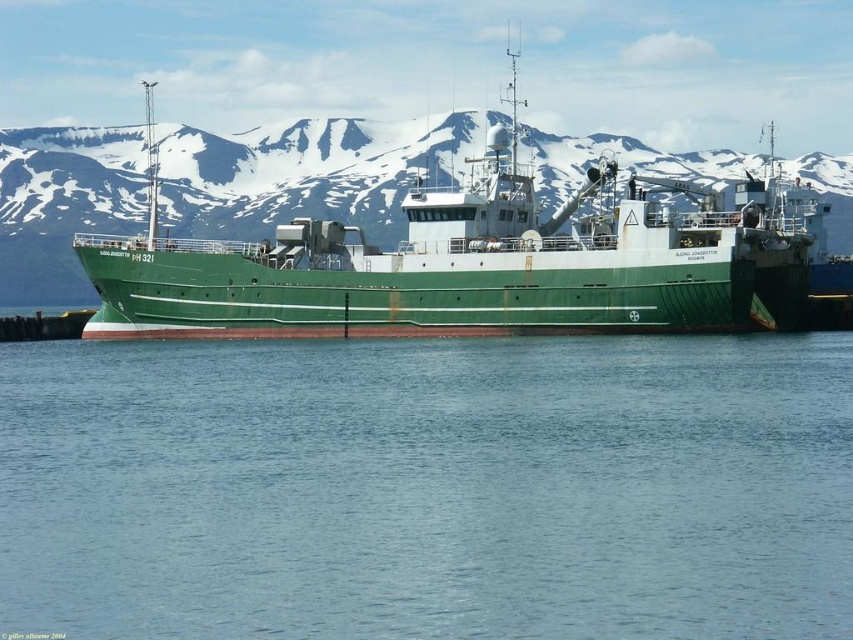
Question: Does blue water at center appear over green matte ship at center?

Choices:
 (A) no
 (B) yes

Answer: (A)

Question: Which point is closer to the camera?

Choices:
 (A) (424, 285)
 (B) (1, 545)

Answer: (B)

Question: Is blue water at center further to camera compared to green matte ship at center?

Choices:
 (A) yes
 (B) no

Answer: (B)

Question: Does blue water at center have a smaller size compared to green matte ship at center?

Choices:
 (A) no
 (B) yes

Answer: (B)

Question: Among these points, which one is farthest from the camera?

Choices:
 (A) (422, 289)
 (B) (38, 468)

Answer: (A)